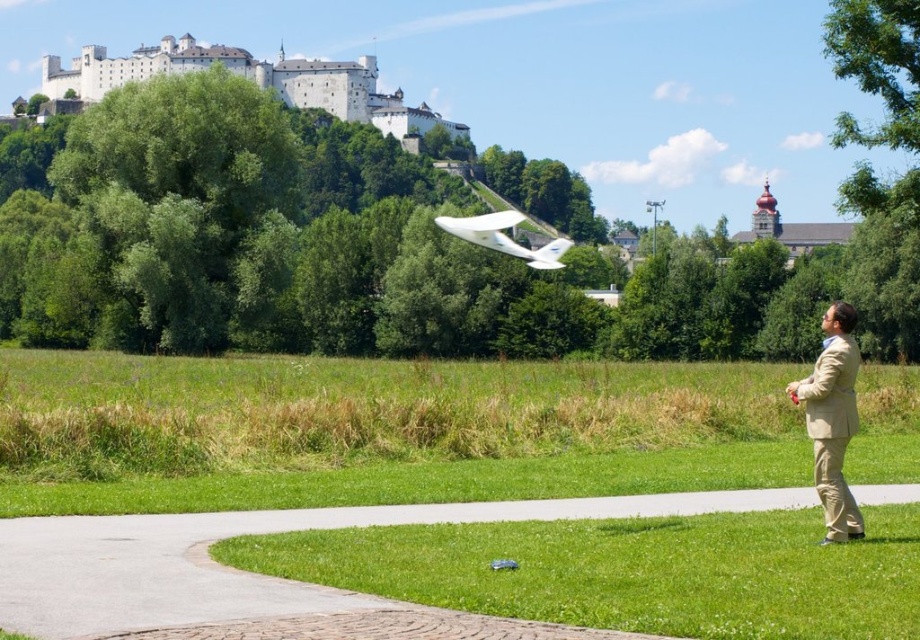
From the picture: Between tan fabric suit at right and white matte glider at center, which one is positioned lower?

tan fabric suit at right is below.

Does tan fabric suit at right have a greater width compared to white matte glider at center?

Correct, the width of tan fabric suit at right exceeds that of white matte glider at center.

Describe the element at coordinates (832, 419) in the screenshot. I see `tan fabric suit at right` at that location.

At what (x,y) coordinates should I click in order to perform the action: click on tan fabric suit at right. Please return your answer as a coordinate pair (x, y). Looking at the image, I should click on (832, 419).

Between green grass at lower right and white matte glider at center, which one has less height?

With less height is green grass at lower right.

Is the position of green grass at lower right more distant than that of white matte glider at center?

That is False.

Is point (880, 420) positioned after point (457, 236)?

Yes.

At what (x,y) coordinates should I click in order to perform the action: click on green grass at lower right. Please return your answer as a coordinate pair (x, y). Image resolution: width=920 pixels, height=640 pixels. Looking at the image, I should click on (391, 429).

Does green grass at lower right have a larger size compared to tan fabric suit at right?

Yes.

Can you confirm if green grass at lower right is wider than tan fabric suit at right?

Yes.

Is point (629, 406) positioned after point (828, 346)?

Yes, it is.

What are the coordinates of `green grass at lower right` in the screenshot? It's located at (391, 429).